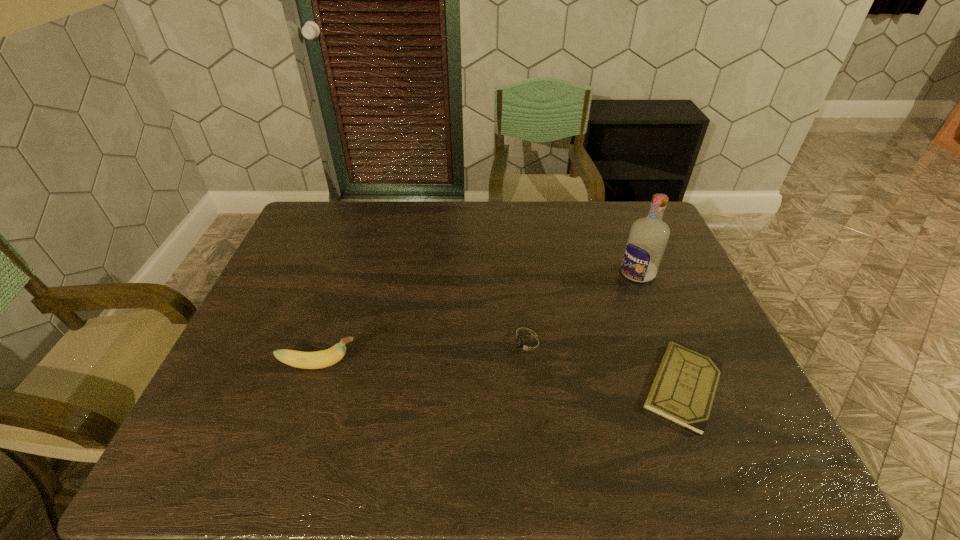
You are a GUI agent. You are given a task and a screenshot of the screen. Output one action in this format:
    pyautogui.click(x=<x>, y=<y>)
    Task: Click on the leftmost object
    
    Given the screenshot: What is the action you would take?
    pyautogui.click(x=318, y=359)

Where is `banana`? This screenshot has width=960, height=540. banana is located at coordinates (318, 359).

Where is `checkbook`? The width and height of the screenshot is (960, 540). checkbook is located at coordinates pos(683,390).

What are the coordinates of `watch` in the screenshot? It's located at (528, 344).

Find the location of `the second shortest object`. the second shortest object is located at coordinates (528, 344).

The image size is (960, 540). What are the coordinates of `the tallest object` in the screenshot? It's located at (646, 243).

Image resolution: width=960 pixels, height=540 pixels. I want to click on vodka, so click(x=646, y=243).

I want to click on free spot located 0.140m at the stem of the banana, so click(418, 364).

You are a GUI agent. You are given a task and a screenshot of the screen. Output one action in this format:
    pyautogui.click(x=<x>, y=<y>)
    Task: Click on the vacant space situated 0.060m on the back of the shortest object
    This screenshot has height=540, width=960.
    Given the screenshot: What is the action you would take?
    pyautogui.click(x=660, y=328)

Locate an element on the screen. The width and height of the screenshot is (960, 540). free point located 0.110m on the face of the watch is located at coordinates tap(466, 368).